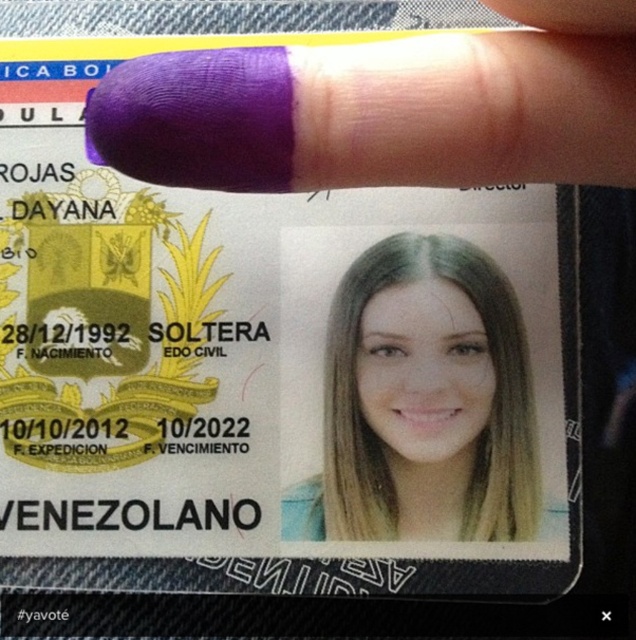
You are a passport officer examining the Venezuelan national identity card. You notice a point labeled with coordinates in the image. What does the point at coordinates point (385, 108) correspond to?

The point at coordinates point (385, 108) corresponds to the purple matte nail at upper center.

You are a border control agent examining a Venezuelan national identity card. The card has a purple matte nail at upper center. According to the security features of Venezuelan ID cards, where should this nail be located? Is its current position at point 0.170, 0.607 compliant with the standard?

The standard position for the purple matte nail at upper center on Venezuelan ID cards is at point (385,108). Therefore, the current position is compliant with the standard.

You are a border control officer examining the Venezuelan national identity card. You notice the purple matte nail at upper center and the blonde hair at center. How far apart are these two features on the card?

The purple matte nail at upper center and the blonde hair at center are 9.13 inches apart.